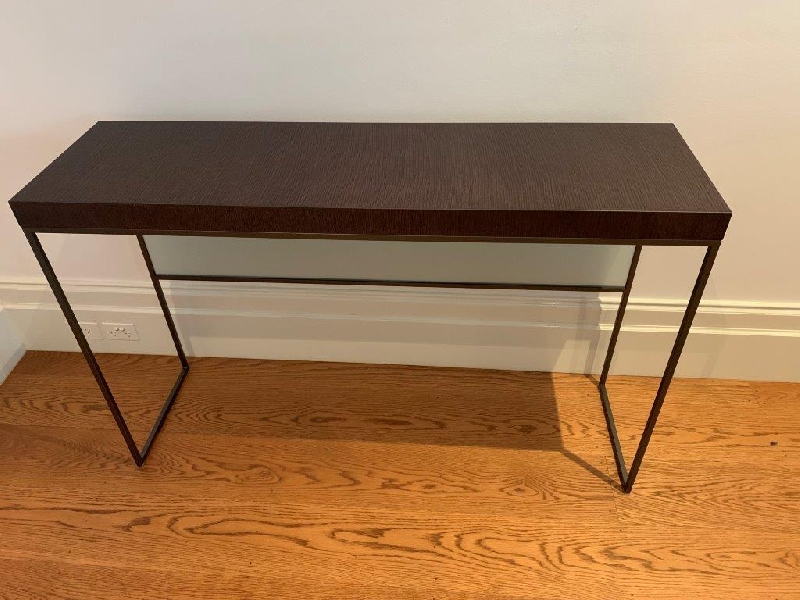
Identify the location of bottom corner of wall. (22, 348).